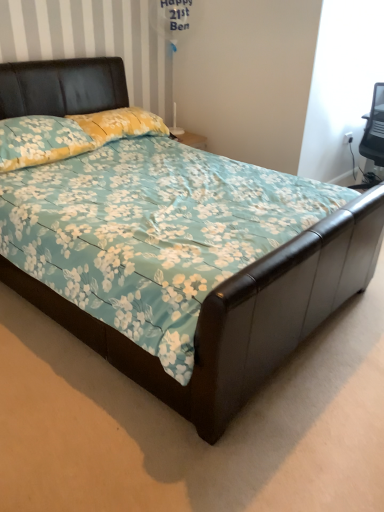
Question: Does floral fabric pillow at upper left, arranged as the first pillow when viewed from the back, appear on the right side of floral fabric pillow at upper left, the 2th pillow positioned from the back?

Choices:
 (A) yes
 (B) no

Answer: (A)

Question: Is floral fabric pillow at upper left, arranged as the first pillow when viewed from the back, wider than floral fabric pillow at upper left, the 2th pillow positioned from the back?

Choices:
 (A) yes
 (B) no

Answer: (B)

Question: Can you confirm if floral fabric pillow at upper left, arranged as the first pillow when viewed from the back, is bigger than floral fabric pillow at upper left, which appears as the 1th pillow when viewed from the front?

Choices:
 (A) yes
 (B) no

Answer: (B)

Question: From a real-world perspective, is floral fabric pillow at upper left, arranged as the first pillow when viewed from the back, under floral fabric pillow at upper left, the 2th pillow positioned from the back?

Choices:
 (A) no
 (B) yes

Answer: (A)

Question: Is floral fabric pillow at upper left, which is counted as the 2th pillow, starting from the front, in contact with floral fabric pillow at upper left, which appears as the 1th pillow when viewed from the front?

Choices:
 (A) no
 (B) yes

Answer: (A)

Question: Is floral fabric pillow at upper left, arranged as the first pillow when viewed from the back, not close to floral fabric pillow at upper left, the 2th pillow positioned from the back?

Choices:
 (A) no
 (B) yes

Answer: (A)

Question: Does floral fabric pillow at upper left, which appears as the 1th pillow when viewed from the front, have a greater height compared to floral fabric pillow at upper left, arranged as the first pillow when viewed from the back?

Choices:
 (A) yes
 (B) no

Answer: (A)

Question: From a real-world perspective, is floral fabric pillow at upper left, which appears as the 1th pillow when viewed from the front, positioned over floral fabric pillow at upper left, which is counted as the 2th pillow, starting from the front, based on gravity?

Choices:
 (A) yes
 (B) no

Answer: (B)

Question: Are floral fabric pillow at upper left, the 2th pillow positioned from the back, and floral fabric pillow at upper left, which is counted as the 2th pillow, starting from the front, far apart?

Choices:
 (A) yes
 (B) no

Answer: (B)

Question: Is floral fabric pillow at upper left, the 2th pillow positioned from the back, bigger than floral fabric pillow at upper left, which is counted as the 2th pillow, starting from the front?

Choices:
 (A) yes
 (B) no

Answer: (A)

Question: Can floral fabric pillow at upper left, which is counted as the 2th pillow, starting from the front, be found inside floral fabric pillow at upper left, which appears as the 1th pillow when viewed from the front?

Choices:
 (A) no
 (B) yes

Answer: (A)

Question: Does floral fabric pillow at upper left, the 2th pillow positioned from the back, lie behind floral fabric pillow at upper left, arranged as the first pillow when viewed from the back?

Choices:
 (A) no
 (B) yes

Answer: (A)

Question: Relative to floral fabric pillow at upper left, the 2th pillow positioned from the back, is floral fabric pillow at upper left, which is counted as the 2th pillow, starting from the front, in front or behind?

Choices:
 (A) behind
 (B) front

Answer: (A)